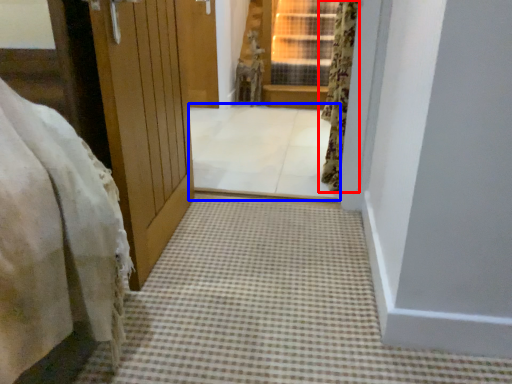
Question: Which object is closer to the camera taking this photo, curtain (highlighted by a red box) or passage (highlighted by a blue box)?

Choices:
 (A) curtain
 (B) passage

Answer: (A)